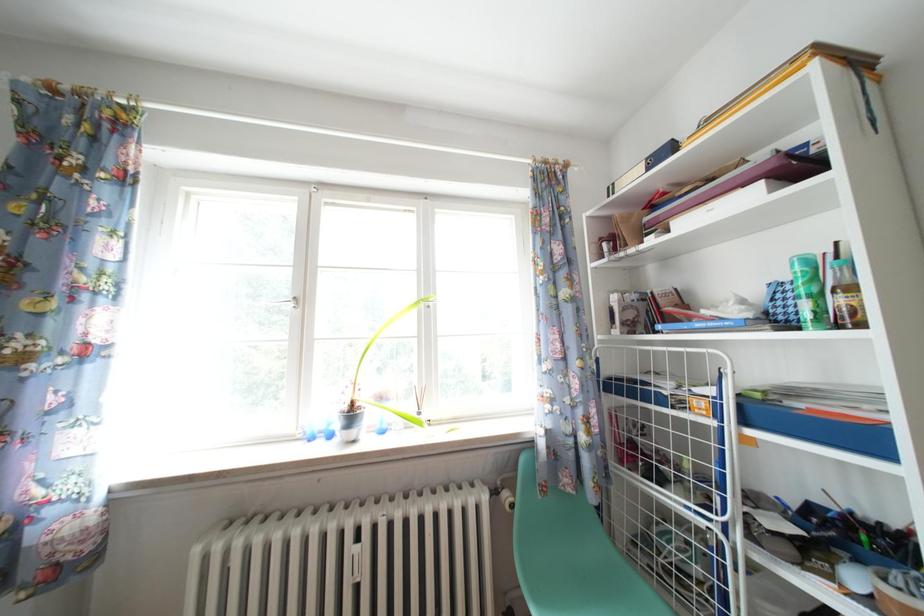
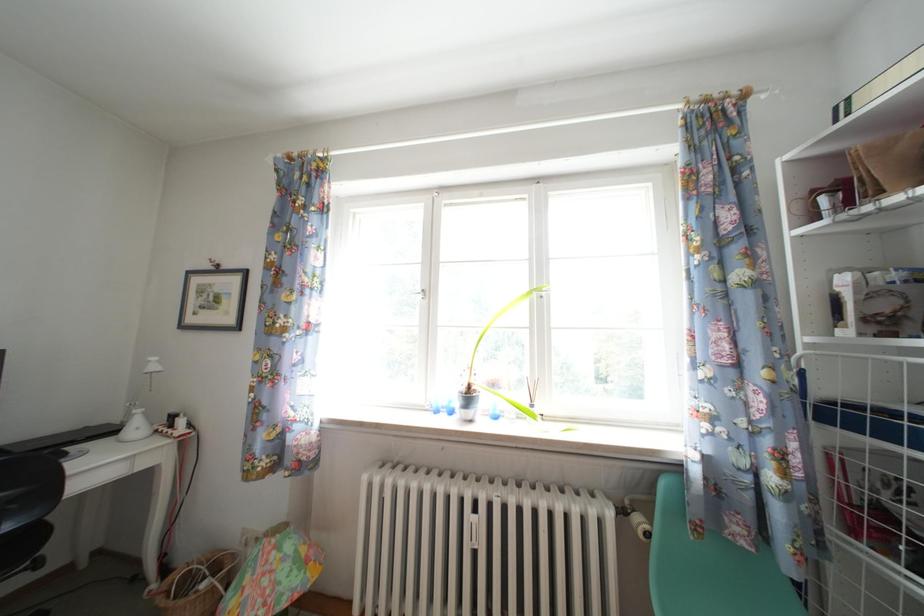
Question: Which direction would the cameraman need to move to produce the second image? Reply with the corresponding letter.

Choices:
 (A) Left
 (B) Right
 (C) Forward
 (D) Backward

Answer: (A)